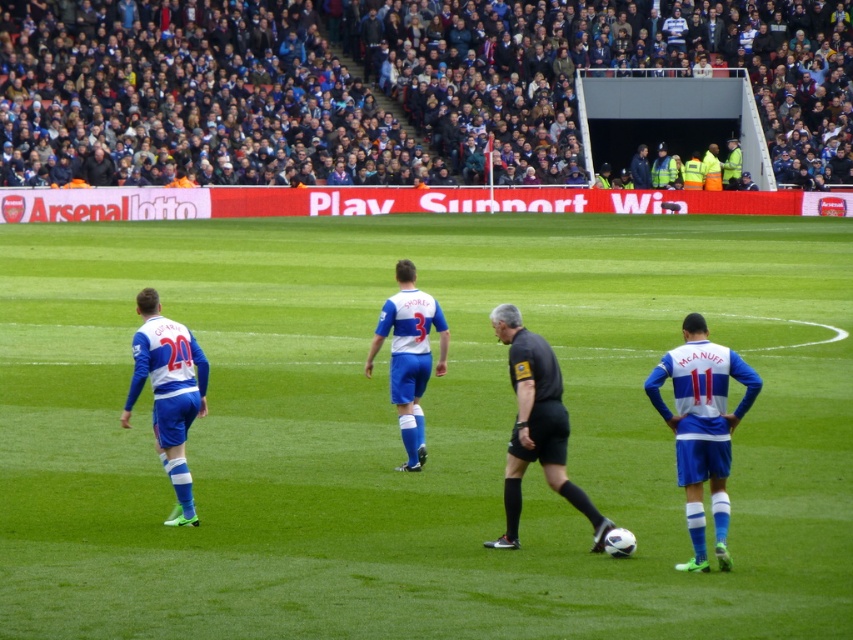
Between blue/white jersey at center and blue fabric jersey at center, which one has less height?

With less height is blue/white jersey at center.

I want to click on blue/white jersey at center, so click(x=701, y=428).

Does point (699, 454) come in front of point (171, 396)?

Yes, it is.

Find the location of a particular element. blue/white jersey at center is located at coordinates (701, 428).

Does blue jersey at right have a lesser height compared to white matte jersey at center?

Indeed, blue jersey at right has a lesser height compared to white matte jersey at center.

Where is `blue jersey at right`? This screenshot has width=853, height=640. blue jersey at right is located at coordinates (701, 428).

Is point (689, 413) closer to camera compared to point (415, 388)?

Yes, it is in front of point (415, 388).

I want to click on blue jersey at right, so (701, 428).

Does black matte referee at center come in front of blue fabric jersey at center?

Yes, black matte referee at center is in front of blue fabric jersey at center.

Does black matte referee at center appear on the left side of blue fabric jersey at center?

In fact, black matte referee at center is to the right of blue fabric jersey at center.

Image resolution: width=853 pixels, height=640 pixels. I want to click on black matte referee at center, so click(537, 426).

The width and height of the screenshot is (853, 640). Find the location of `black matte referee at center`. black matte referee at center is located at coordinates (537, 426).